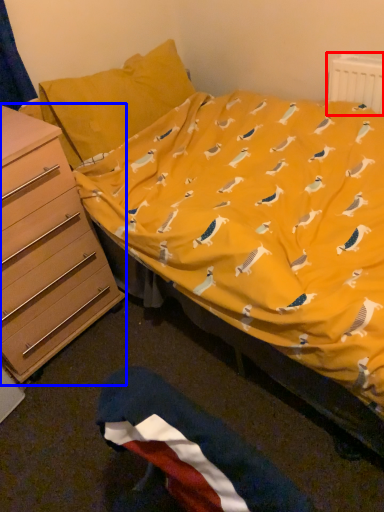
Question: Which point is further to the camera, radiator (highlighted by a red box) or chest of drawers (highlighted by a blue box)?

Choices:
 (A) radiator
 (B) chest of drawers

Answer: (A)